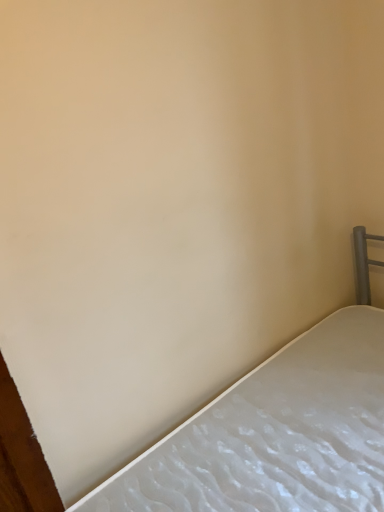
What do you see at coordinates (275, 434) in the screenshot?
I see `white textured mattress at lower right` at bounding box center [275, 434].

Where is `white textured mattress at lower right`? This screenshot has height=512, width=384. white textured mattress at lower right is located at coordinates (275, 434).

Locate an element on the screen. white textured mattress at lower right is located at coordinates (275, 434).